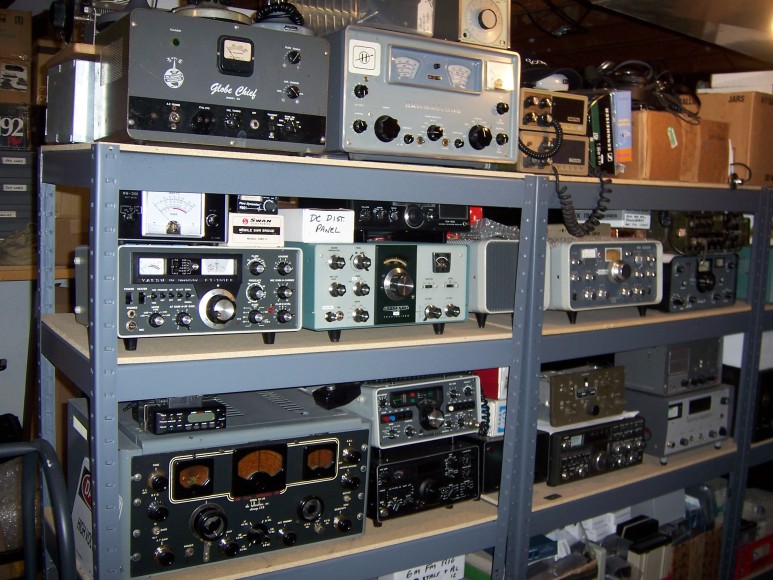
Image resolution: width=773 pixels, height=580 pixels. I want to click on glow from lightbulb, so click(771, 25).